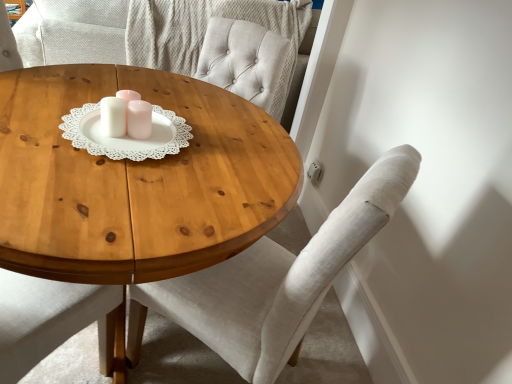
What is the approximate width of wooden coffee table at center?

wooden coffee table at center is 1.14 meters in width.

The image size is (512, 384). Find the location of `light gray fabric chair at center`. light gray fabric chair at center is located at coordinates (275, 280).

In terms of width, does light gray fabric chair at center look wider or thinner when compared to wooden coffee table at center?

Clearly, light gray fabric chair at center has less width compared to wooden coffee table at center.

Measure the distance from light gray fabric chair at center to wooden coffee table at center.

14.98 inches.

Is light gray fabric chair at center not inside wooden coffee table at center?

No, most part of light gray fabric chair at center lies within wooden coffee table at center.

Is light gray fabric chair at center to the right of wooden coffee table at center from the viewer's perspective?

Indeed, light gray fabric chair at center is positioned on the right side of wooden coffee table at center.

From the image's perspective, which is below, white glossy candle holder at center or wooden coffee table at center?

wooden coffee table at center.

Is white glossy candle holder at center outside of wooden coffee table at center?

Yes, white glossy candle holder at center is located beyond the bounds of wooden coffee table at center.

What are the coordinates of `candle holder behind the wooden coffee table at center` in the screenshot? It's located at (126, 116).

Is white glossy candle holder at center positioned far away from light gray fabric chair at center?

Actually, white glossy candle holder at center and light gray fabric chair at center are a little close together.

In terms of width, does white glossy candle holder at center look wider or thinner when compared to light gray fabric chair at center?

Considering their sizes, white glossy candle holder at center looks slimmer than light gray fabric chair at center.

From a real-world perspective, is white glossy candle holder at center physically below light gray fabric chair at center?

No, from a real-world perspective, white glossy candle holder at center is not beneath light gray fabric chair at center.

In the scene shown: Which object is wider, light gray fabric chair at center or white glossy candle holder at center?

light gray fabric chair at center.

Where is `chair below the white glossy candle holder at center (from the image's perspective)`? This screenshot has height=384, width=512. chair below the white glossy candle holder at center (from the image's perspective) is located at coordinates point(275,280).

Would you consider light gray fabric chair at center to be distant from white glossy candle holder at center?

No, there isn't a large distance between light gray fabric chair at center and white glossy candle holder at center.

From a real-world perspective, between light gray fabric chair at center and white glossy candle holder at center, who is vertically lower?

In real-world perspective, light gray fabric chair at center is lower.

Is wooden coffee table at center taller or shorter than white glossy candle holder at center?

Clearly, wooden coffee table at center is taller compared to white glossy candle holder at center.

Does wooden coffee table at center have a smaller size compared to white glossy candle holder at center?

Incorrect, wooden coffee table at center is not smaller in size than white glossy candle holder at center.

Looking at this image, who is more distant, wooden coffee table at center or white glossy candle holder at center?

white glossy candle holder at center.

Find the location of a particular element. The height and width of the screenshot is (384, 512). coffee table below the white glossy candle holder at center (from a real-world perspective) is located at coordinates (x=135, y=180).

Are wooden coffee table at center and light gray fabric chair at center beside each other?

No, wooden coffee table at center is not with light gray fabric chair at center.

How many degrees apart are the facing directions of wooden coffee table at center and light gray fabric chair at center?

They differ by 55.4 degrees in their facing directions.

Which of these two, wooden coffee table at center or light gray fabric chair at center, stands taller?

With more height is light gray fabric chair at center.

Which is correct: wooden coffee table at center is inside light gray fabric chair at center, or outside of it?

wooden coffee table at center is not enclosed by light gray fabric chair at center.

The image size is (512, 384). Find the location of `coffee table that appears in front of the light gray fabric chair at center`. coffee table that appears in front of the light gray fabric chair at center is located at coordinates (135, 180).

Locate an element on the screen. The image size is (512, 384). candle holder lying above the wooden coffee table at center (from the image's perspective) is located at coordinates pyautogui.click(x=126, y=116).

Which object lies further to the anchor point wooden coffee table at center, light gray fabric chair at center or white glossy candle holder at center?

The object further to wooden coffee table at center is light gray fabric chair at center.

Looking at the image, which one is located closer to white glossy candle holder at center, light gray fabric chair at center or wooden coffee table at center?

Based on the image, wooden coffee table at center appears to be nearer to white glossy candle holder at center.

When comparing their distances from light gray fabric chair at center, does white glossy candle holder at center or wooden coffee table at center seem closer?

wooden coffee table at center lies closer to light gray fabric chair at center than the other object.

Estimate the real-world distances between objects in this image. Which object is further from light gray fabric chair at center, wooden coffee table at center or white glossy candle holder at center?

The object further to light gray fabric chair at center is white glossy candle holder at center.

Estimate the real-world distances between objects in this image. Which object is closer to white glossy candle holder at center, wooden coffee table at center or light gray fabric chair at center?

wooden coffee table at center is closer to white glossy candle holder at center.

Estimate the real-world distances between objects in this image. Which object is further from wooden coffee table at center, white glossy candle holder at center or light gray fabric chair at center?

light gray fabric chair at center.

Where is `candle holder between wooden coffee table at center and light gray fabric chair at center`? candle holder between wooden coffee table at center and light gray fabric chair at center is located at coordinates tap(126, 116).